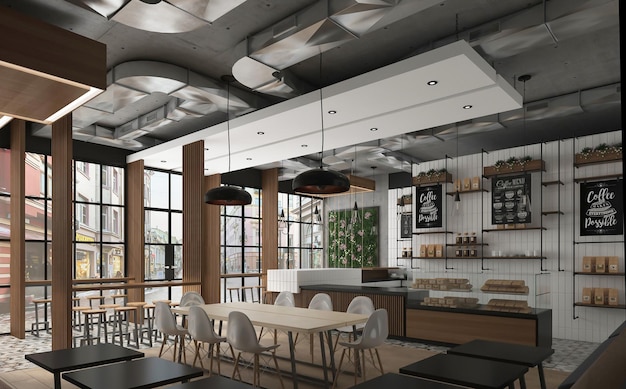
Find the location of a particular element. The width and height of the screenshot is (626, 389). tables is located at coordinates (77, 355), (120, 374), (213, 381), (394, 382), (451, 369), (495, 350), (290, 315).